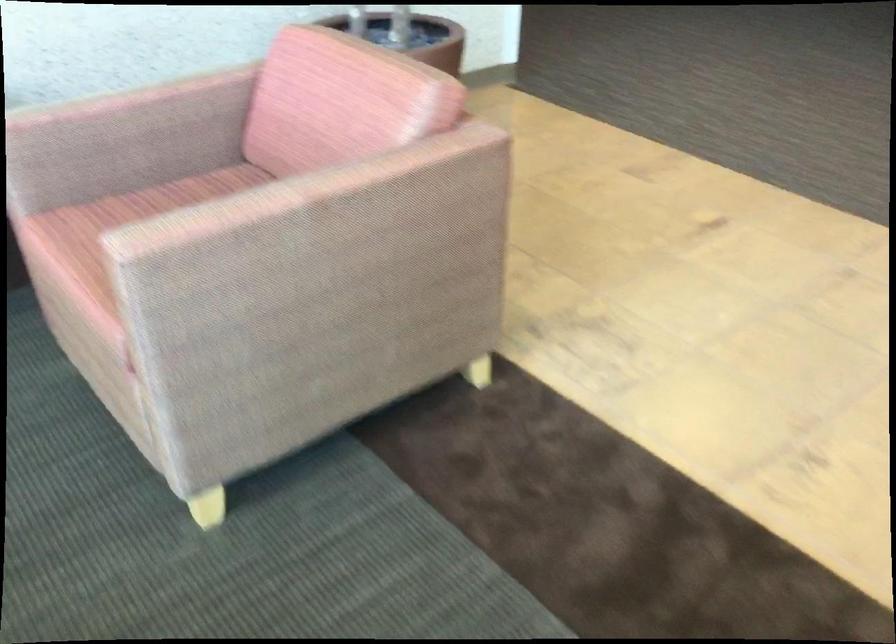
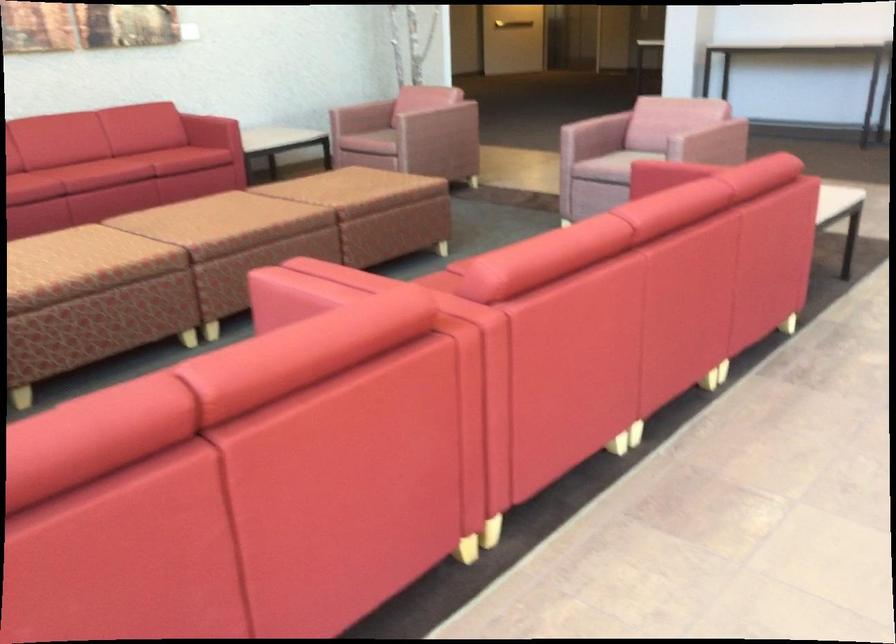
In the second image, find the point that corresponds to point (255, 234) in the first image.

(431, 106)